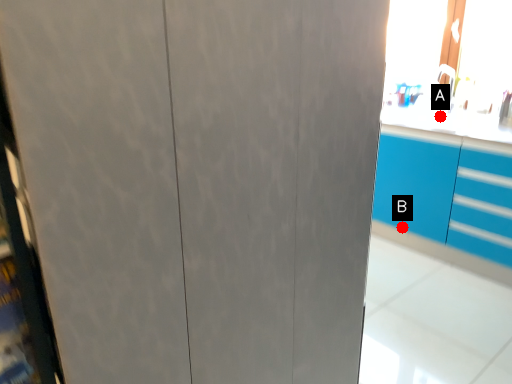
Question: Two points are circled on the image, labeled by A and B beside each circle. Which point is closer to the camera?

Choices:
 (A) A is closer
 (B) B is closer

Answer: (A)